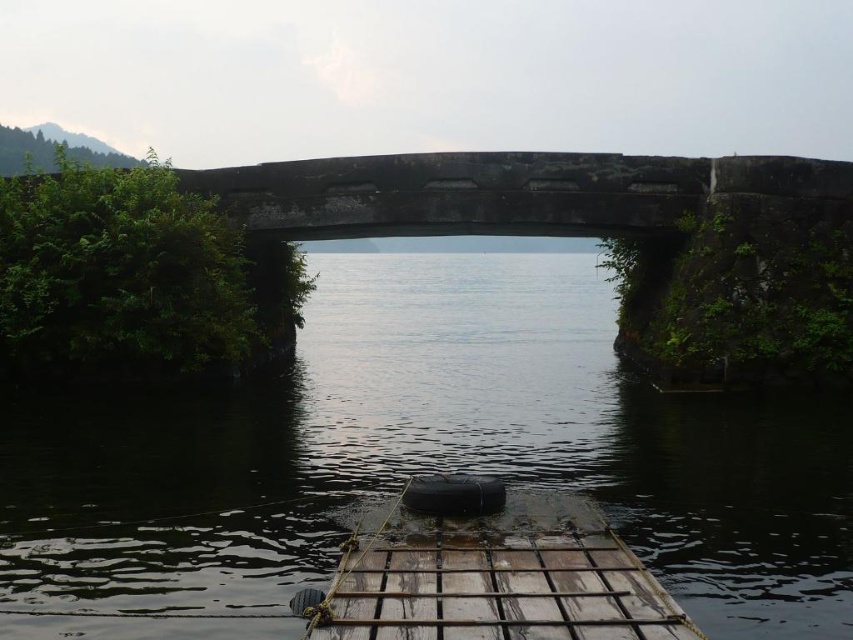
Does black rubber boat at center lie in front of wooden planks boat at center?

No, black rubber boat at center is behind wooden planks boat at center.

Is black rubber boat at center above wooden planks boat at center?

Correct, black rubber boat at center is located above wooden planks boat at center.

Between point (387, 467) and point (486, 589), which one is positioned behind?

Positioned behind is point (387, 467).

Locate an element on the screen. black rubber boat at center is located at coordinates (428, 456).